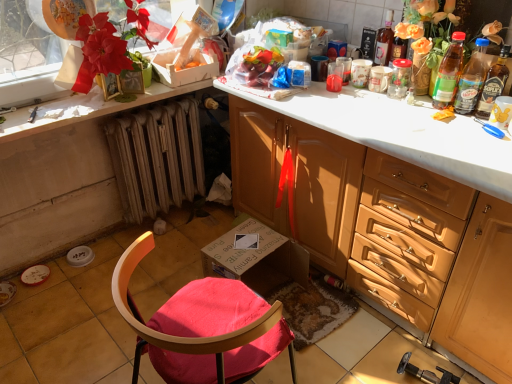
Measure the distance between translucent plastic bottle at upper right, the 1th bottle when ordered from right to left, and camera.

They are 1.48 meters apart.

Identify the location of translucent plastic bottle at upper right, acting as the 4th bottle starting from the left. (493, 84).

This screenshot has height=384, width=512. Describe the element at coordinates (86, 109) in the screenshot. I see `white glossy countertop at upper left` at that location.

Locate an element on the screen. The width and height of the screenshot is (512, 384). translucent plastic bottle at upper center, which is counted as the first bottle, starting from the left is located at coordinates (384, 41).

From a real-world perspective, which object rests below the other?

wooden chair at lower center, from a real-world perspective.

Does wooden chair at lower center have a greater height compared to translucent plastic bottle at upper right, which is the third bottle from left to right?

Yes.

From the image's perspective, does wooden chair at lower center appear higher than translucent plastic bottle at upper right, which is counted as the 2th bottle, starting from the right?

Actually, wooden chair at lower center appears below translucent plastic bottle at upper right, which is counted as the 2th bottle, starting from the right, in the image.

Is matte wood cabinet at center positioned with its back to translucent plastic bottle at upper center, which is the 4th bottle in right-to-left order?

That's not correct — matte wood cabinet at center is not looking away from translucent plastic bottle at upper center, which is the 4th bottle in right-to-left order.

Image resolution: width=512 pixels, height=384 pixels. I want to click on cabinetry directly beneath the translucent plastic bottle at upper center, which is the 4th bottle in right-to-left order (from a real-world perspective), so click(x=388, y=231).

Is matte wood cabinet at center positioned before translucent plastic bottle at upper center, which is the 4th bottle in right-to-left order?

Yes, matte wood cabinet at center is closer to the viewer.

Can you tell me how much matte wood cabinet at center and translucent plastic bottle at upper center, which is counted as the first bottle, starting from the left, differ in facing direction?

The facing directions of matte wood cabinet at center and translucent plastic bottle at upper center, which is counted as the first bottle, starting from the left, are 0.000484 degrees apart.

In the scene shown: Considering the sizes of translucent plastic bottle at upper right, the 1th bottle when ordered from right to left, and wooden radiator at lower left in the image, is translucent plastic bottle at upper right, the 1th bottle when ordered from right to left, bigger or smaller than wooden radiator at lower left?

Clearly, translucent plastic bottle at upper right, the 1th bottle when ordered from right to left, is smaller in size than wooden radiator at lower left.

Is translucent plastic bottle at upper right, acting as the 4th bottle starting from the left, oriented away from wooden radiator at lower left?

That's not correct — translucent plastic bottle at upper right, acting as the 4th bottle starting from the left, is not looking away from wooden radiator at lower left.

Is translucent plastic bottle at upper right, acting as the 4th bottle starting from the left, in contact with wooden radiator at lower left?

translucent plastic bottle at upper right, acting as the 4th bottle starting from the left, is not next to wooden radiator at lower left, and they're not touching.

Is translucent plastic bottle at upper right, the 1th bottle when ordered from right to left, at the left side of wooden radiator at lower left?

Incorrect, translucent plastic bottle at upper right, the 1th bottle when ordered from right to left, is not on the left side of wooden radiator at lower left.

Consider the image. Considering the relative sizes of translucent plastic bottle at upper right, which is counted as the 2th bottle, starting from the right, and translucent plastic bottle at upper center, which is counted as the first bottle, starting from the left, in the image provided, is translucent plastic bottle at upper right, which is counted as the 2th bottle, starting from the right, shorter than translucent plastic bottle at upper center, which is counted as the first bottle, starting from the left,?

No.

Which of these two, translucent plastic bottle at upper right, which is counted as the 2th bottle, starting from the right, or translucent plastic bottle at upper center, which is counted as the first bottle, starting from the left, is bigger?

translucent plastic bottle at upper right, which is counted as the 2th bottle, starting from the right.

Is point (478, 43) positioned after point (386, 25)?

No, (478, 43) is closer to viewer.

Is translucent plastic bottle at upper center, which is the 4th bottle in right-to-left order, located within translucent plastic bottle at upper right, which is counted as the 2th bottle, starting from the right?

No, translucent plastic bottle at upper center, which is the 4th bottle in right-to-left order, is not inside translucent plastic bottle at upper right, which is counted as the 2th bottle, starting from the right.

From the image's perspective, which is above, translucent plastic bottle at upper right, marked as the 3th bottle in a right-to-left arrangement, or translucent plastic bottle at upper right, acting as the 4th bottle starting from the left?

translucent plastic bottle at upper right, marked as the 3th bottle in a right-to-left arrangement, is shown above in the image.

Find the location of a particular element. the 2nd bottle behind the translucent plastic bottle at upper right, acting as the 4th bottle starting from the left is located at coordinates (449, 72).

Does point (440, 77) come closer to viewer compared to point (490, 111)?

No.

How many degrees apart are the facing directions of translucent plastic bottle at upper right, which appears as the second bottle when viewed from the left, and translucent plastic bottle at upper right, acting as the 4th bottle starting from the left?

translucent plastic bottle at upper right, which appears as the second bottle when viewed from the left, and translucent plastic bottle at upper right, acting as the 4th bottle starting from the left, are facing 0.00209 degrees away from each other.

Consider the image. Is wooden chair at lower center next to translucent plastic bottle at upper right, marked as the 3th bottle in a right-to-left arrangement?

No.

Is wooden chair at lower center to the left or to the right of translucent plastic bottle at upper right, marked as the 3th bottle in a right-to-left arrangement, in the image?

wooden chair at lower center is positioned on translucent plastic bottle at upper right, marked as the 3th bottle in a right-to-left arrangement,'s left side.

Is wooden chair at lower center taller or shorter than translucent plastic bottle at upper right, marked as the 3th bottle in a right-to-left arrangement?

wooden chair at lower center is taller than translucent plastic bottle at upper right, marked as the 3th bottle in a right-to-left arrangement.

Are translucent plastic bottle at upper right, which is counted as the 2th bottle, starting from the right, and matte wood cabinet at center located far from each other?

No, translucent plastic bottle at upper right, which is counted as the 2th bottle, starting from the right, is in close proximity to matte wood cabinet at center.

Considering the relative sizes of translucent plastic bottle at upper right, which is counted as the 2th bottle, starting from the right, and matte wood cabinet at center in the image provided, is translucent plastic bottle at upper right, which is counted as the 2th bottle, starting from the right, shorter than matte wood cabinet at center?

Yes, translucent plastic bottle at upper right, which is counted as the 2th bottle, starting from the right, is shorter than matte wood cabinet at center.

Starting from the matte wood cabinet at center, which bottle is the 3rd one to the right? Please provide its 2D coordinates.

[(472, 79)]

Which is less distant, (462,105) or (396,179)?

Point (462,105) appears to be farther away from the viewer than point (396,179).

Locate an element on the screen. chair lying on the left of translucent plastic bottle at upper right, which is the third bottle from left to right is located at coordinates (202, 327).

Image resolution: width=512 pixels, height=384 pixels. In order to click on cabinetry that is in front of the translucent plastic bottle at upper center, which is counted as the first bottle, starting from the left in this screenshot , I will do `click(388, 231)`.

From the image, which object appears to be farther from translucent plastic bottle at upper right, the 1th bottle when ordered from right to left, translucent plastic bottle at upper right, marked as the 3th bottle in a right-to-left arrangement, or white glossy countertop at upper left?

white glossy countertop at upper left lies further to translucent plastic bottle at upper right, the 1th bottle when ordered from right to left, than the other object.

Looking at the image, which one is located closer to wooden chair at lower center, white glossy countertop at upper left or wooden radiator at lower left?

white glossy countertop at upper left lies closer to wooden chair at lower center than the other object.

Estimate the real-world distances between objects in this image. Which object is closer to translucent plastic bottle at upper right, which is the third bottle from left to right, wooden chair at lower center or wooden radiator at lower left?

The object closer to translucent plastic bottle at upper right, which is the third bottle from left to right, is wooden chair at lower center.

Looking at the image, which one is located further to translucent plastic bottle at upper right, acting as the 4th bottle starting from the left, translucent plastic bottle at upper center, which is counted as the first bottle, starting from the left, or matte wood cabinet at center?

matte wood cabinet at center is positioned further to the anchor translucent plastic bottle at upper right, acting as the 4th bottle starting from the left.

Estimate the real-world distances between objects in this image. Which object is further from translucent plastic bottle at upper right, marked as the 3th bottle in a right-to-left arrangement, translucent plastic bottle at upper right, which is the third bottle from left to right, or matte wood cabinet at center?

matte wood cabinet at center lies further to translucent plastic bottle at upper right, marked as the 3th bottle in a right-to-left arrangement, than the other object.

Which object lies nearer to the anchor point white glossy countertop at upper left, translucent plastic bottle at upper right, the 1th bottle when ordered from right to left, or wooden chair at lower center?

wooden chair at lower center is positioned closer to the anchor white glossy countertop at upper left.

When comparing their distances from matte wood cabinet at center, does wooden radiator at lower left or white glossy countertop at upper left seem closer?

Based on the image, wooden radiator at lower left appears to be nearer to matte wood cabinet at center.

From the image, which object appears to be farther from matte wood cabinet at center, translucent plastic bottle at upper right, the 1th bottle when ordered from right to left, or white glossy countertop at upper left?

The object further to matte wood cabinet at center is white glossy countertop at upper left.

Find the location of a particular element. cabinetry between white glossy countertop at upper left and translucent plastic bottle at upper center, which is the 4th bottle in right-to-left order is located at coordinates (388, 231).

Locate an element on the screen. Image resolution: width=512 pixels, height=384 pixels. radiator between translucent plastic bottle at upper center, which is counted as the first bottle, starting from the left, and wooden chair at lower center, in the vertical direction is located at coordinates (157, 157).

Identify the location of chair situated between white glossy countertop at upper left and matte wood cabinet at center from left to right. (202, 327).

Where is `cabinetry between translucent plastic bottle at upper center, which is counted as the first bottle, starting from the left, and wooden chair at lower center in the up-down direction`? The height and width of the screenshot is (384, 512). cabinetry between translucent plastic bottle at upper center, which is counted as the first bottle, starting from the left, and wooden chair at lower center in the up-down direction is located at coordinates (388, 231).